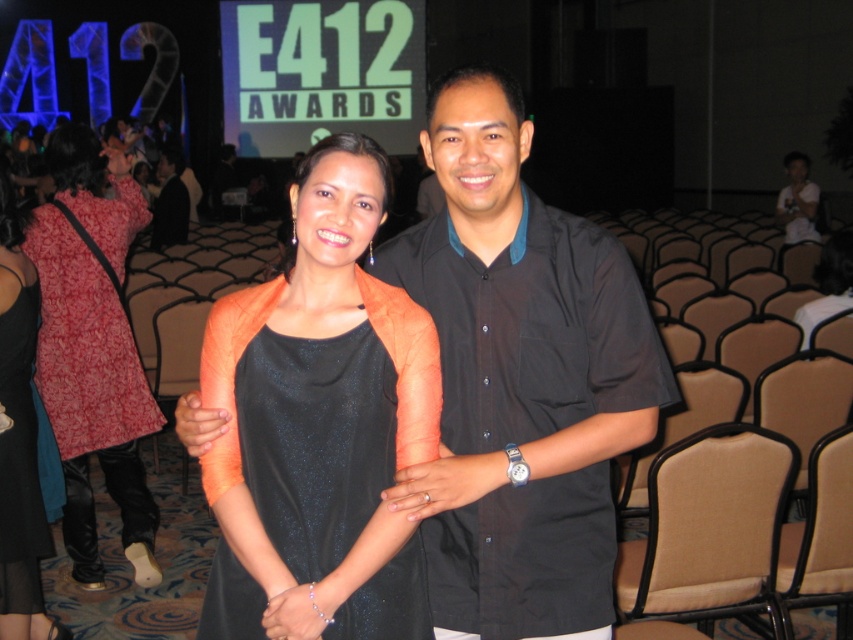
Question: Is black glittery dress at center closer to camera compared to beige fabric chair at lower right?

Choices:
 (A) no
 (B) yes

Answer: (B)

Question: Which point is farther to the camera?

Choices:
 (A) beige fabric chair at lower right
 (B) black glittery dress at center
 (C) dark gray suit at left

Answer: (C)

Question: Can you confirm if black satin dress at left is smaller than orange fabric dress at center?

Choices:
 (A) no
 (B) yes

Answer: (B)

Question: Considering the real-world distances, which object is farthest from the black satin dress at left?

Choices:
 (A) black glittery dress at center
 (B) dark gray suit at left
 (C) printed cotton dress at left

Answer: (B)

Question: Does printed cotton dress at left have a lesser width compared to orange fabric dress at center?

Choices:
 (A) no
 (B) yes

Answer: (B)

Question: Among these points, which one is nearest to the camera?

Choices:
 (A) (82, 488)
 (B) (181, 212)
 (C) (656, 592)

Answer: (C)